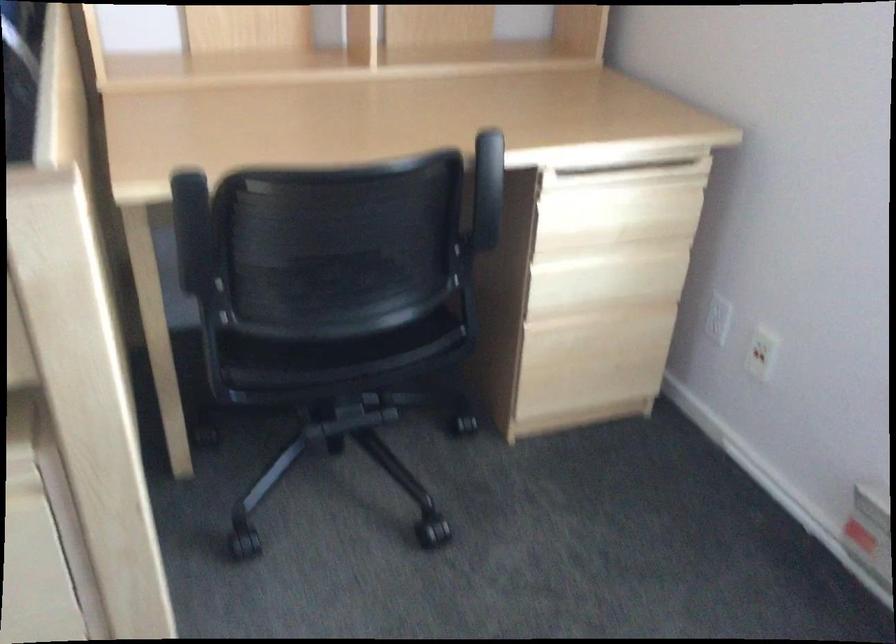
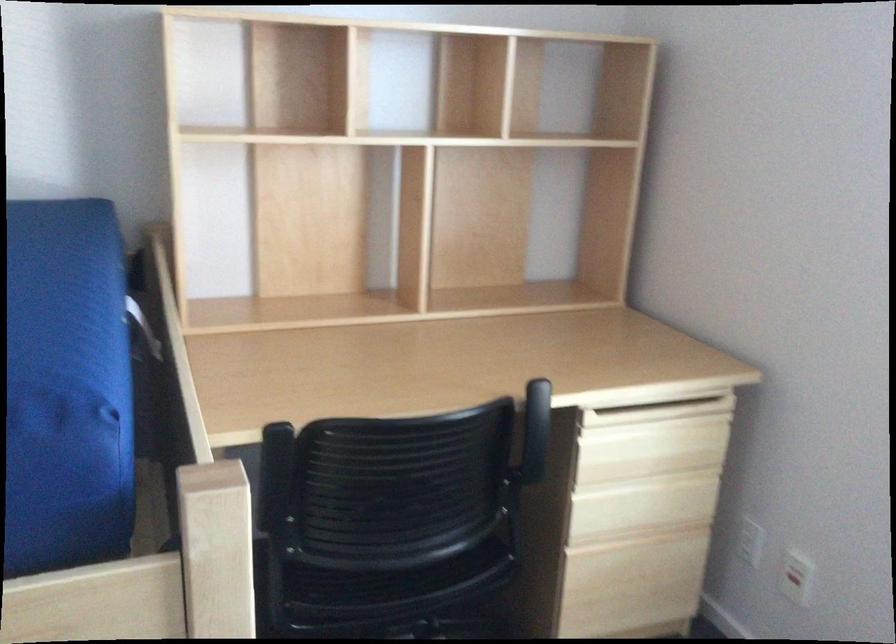
The point at (760,350) is marked in the first image. Where is the corresponding point in the second image?

(796, 576)